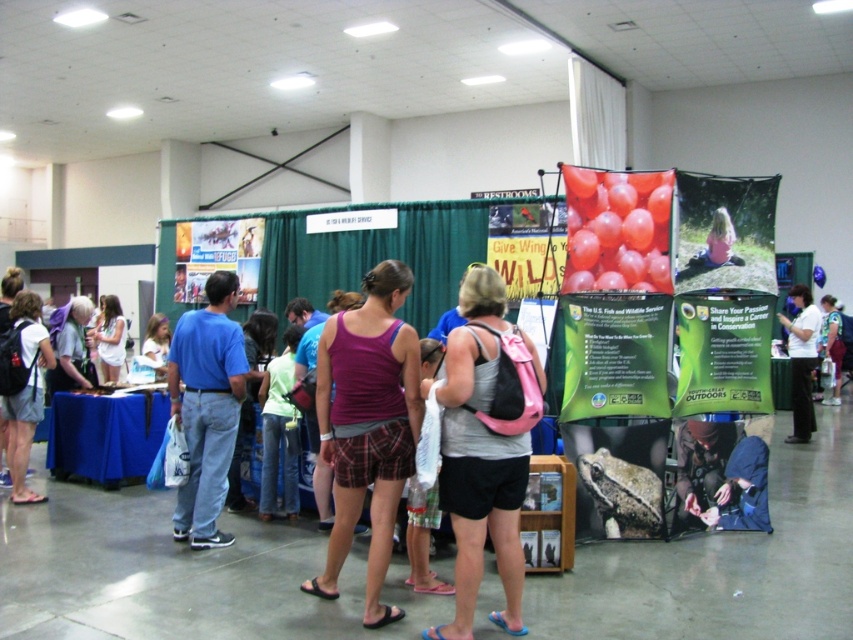
Between point (364, 387) and point (27, 497), which one is positioned behind?

Positioned behind is point (27, 497).

Is purple cotton tank top at center to the right of matte black backpack at left from the viewer's perspective?

Indeed, purple cotton tank top at center is positioned on the right side of matte black backpack at left.

Find the location of a particular element. purple cotton tank top at center is located at coordinates (367, 426).

From the picture: Does purple cotton tank top at center appear under matte purple tank top at center?

Indeed, purple cotton tank top at center is positioned under matte purple tank top at center.

Who is higher up, purple cotton tank top at center or matte purple tank top at center?

matte purple tank top at center is higher up.

Is point (381, 291) positioned behind point (166, 368)?

No, (381, 291) is in front of (166, 368).

Identify the location of purple cotton tank top at center. The image size is (853, 640). (367, 426).

Does gray fabric tank top at center appear on the left side of matte black backpack at left?

In fact, gray fabric tank top at center is to the right of matte black backpack at left.

Which of these two, gray fabric tank top at center or matte black backpack at left, stands shorter?

Standing shorter between the two is matte black backpack at left.

Between point (488, 486) and point (19, 396), which one is positioned behind?

The point (19, 396) is behind.

I want to click on gray fabric tank top at center, so [x=482, y=451].